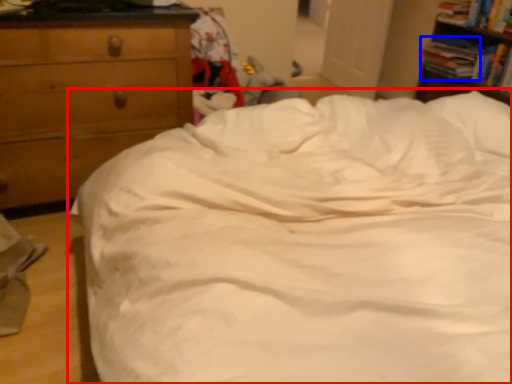
Question: Which object appears closest to the camera in this image, bed (highlighted by a red box) or book (highlighted by a blue box)?

Choices:
 (A) bed
 (B) book

Answer: (A)